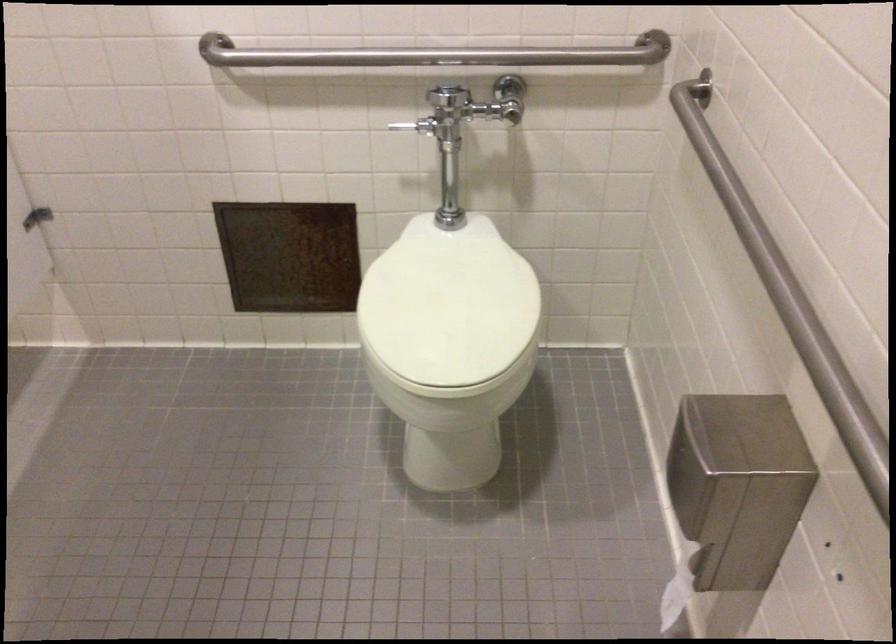
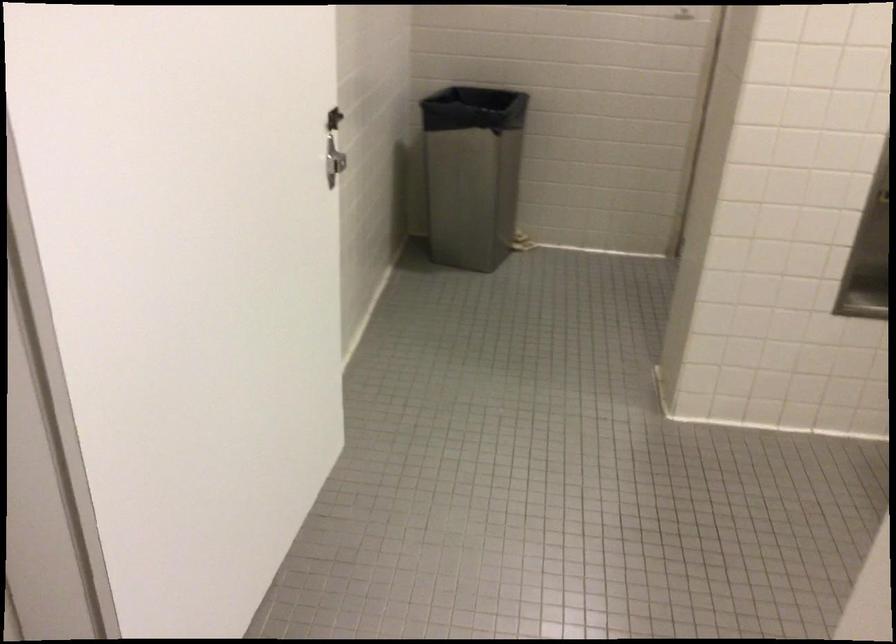
The images are taken continuously from a first-person perspective. In which direction is your viewpoint rotating?

The camera rotated toward left-down.